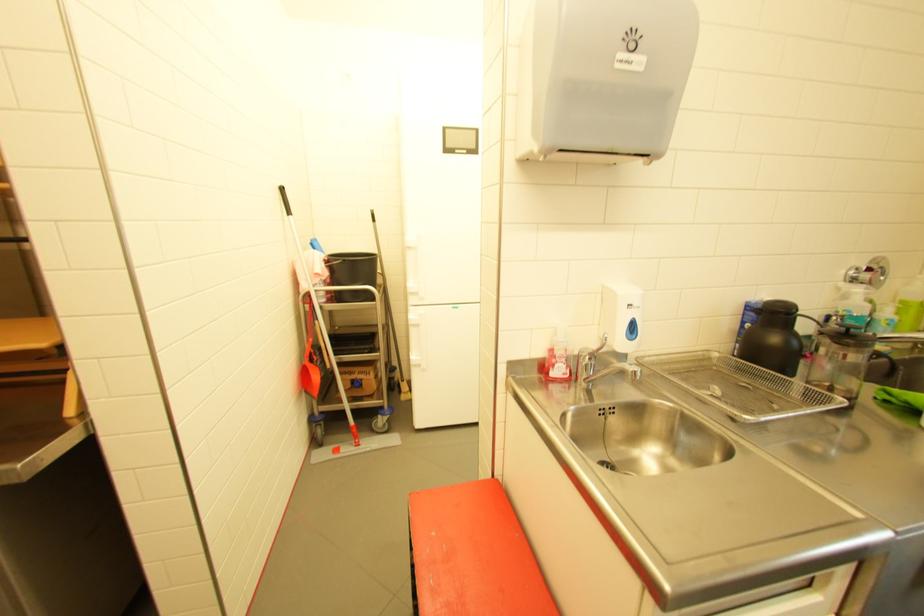
Where would you push the red soap pump? Please return your answer as a coordinate pair (x, y).

(558, 330)